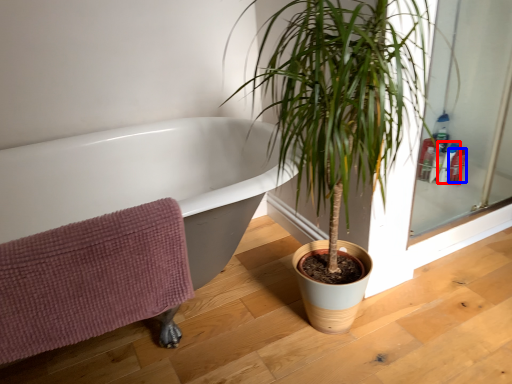
Question: Which point is further to the camera, toiletry (highlighted by a red box) or toiletry (highlighted by a blue box)?

Choices:
 (A) toiletry
 (B) toiletry

Answer: (B)